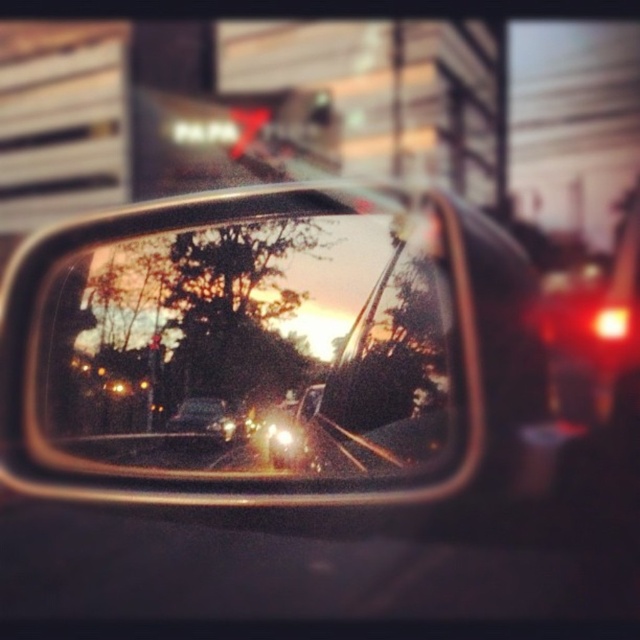
Between metallic silver train track at center and matte black car at center, which one appears on the left side from the viewer's perspective?

matte black car at center

Who is more distant from viewer, (307, 449) or (196, 410)?

The point (196, 410) is more distant.

This screenshot has width=640, height=640. I want to click on metallic silver train track at center, so click(346, 451).

Does metallic reflective mirror at center have a greater width compared to metallic silver train track at center?

Yes, metallic reflective mirror at center is wider than metallic silver train track at center.

Where is `metallic reflective mirror at center`? metallic reflective mirror at center is located at coordinates (241, 346).

Can you confirm if metallic reflective mirror at center is positioned below matte black car at center?

Actually, metallic reflective mirror at center is above matte black car at center.

Looking at this image, is metallic reflective mirror at center shorter than matte black car at center?

No.

Is point (90, 412) positioned after point (228, 429)?

Yes, it is.

Find the location of a particular element. This screenshot has width=640, height=640. metallic reflective mirror at center is located at coordinates (241, 346).